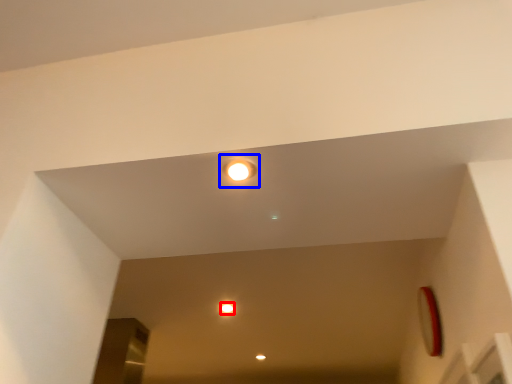
Question: Which object is closer to the camera taking this photo, dot (highlighted by a red box) or light (highlighted by a blue box)?

Choices:
 (A) dot
 (B) light

Answer: (B)